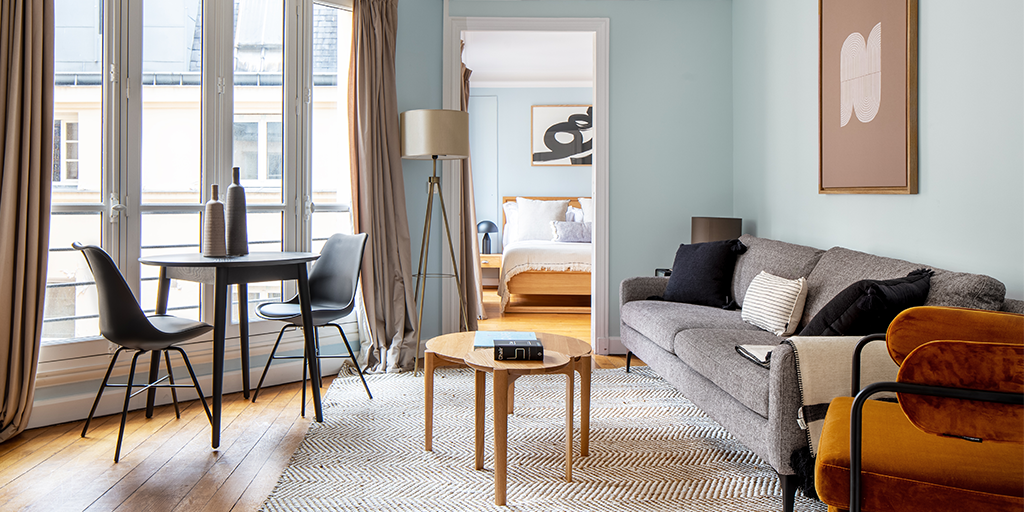
This screenshot has height=512, width=1024. What are the coordinates of `chairs` in the screenshot? It's located at (330, 282), (143, 323).